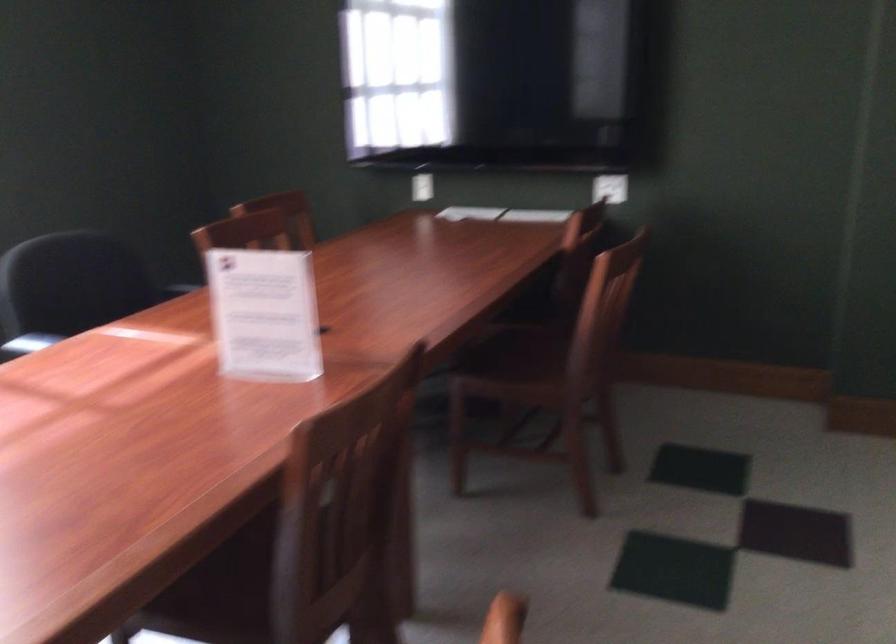
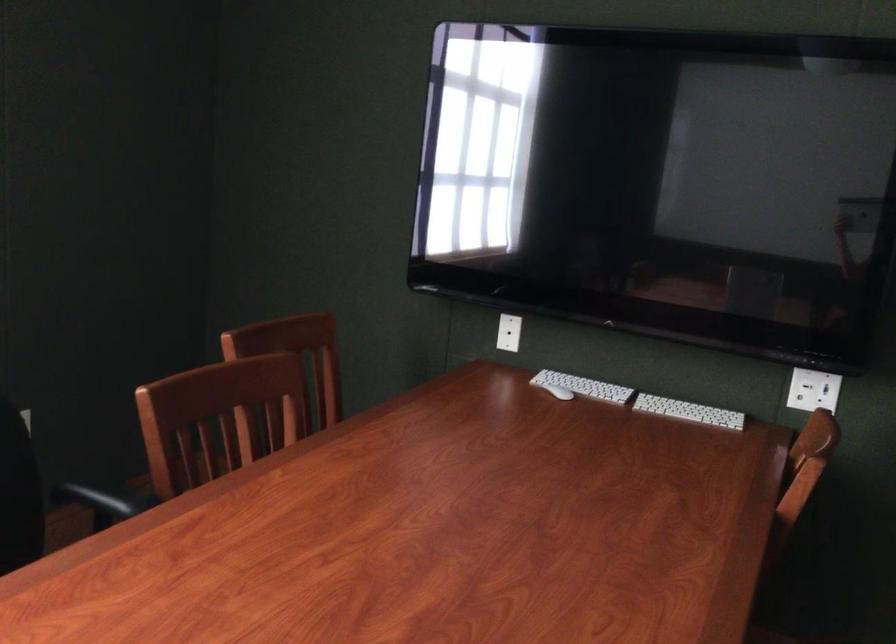
In the second image, find the point that corresponds to the point at 453,214 in the first image.

(558, 392)